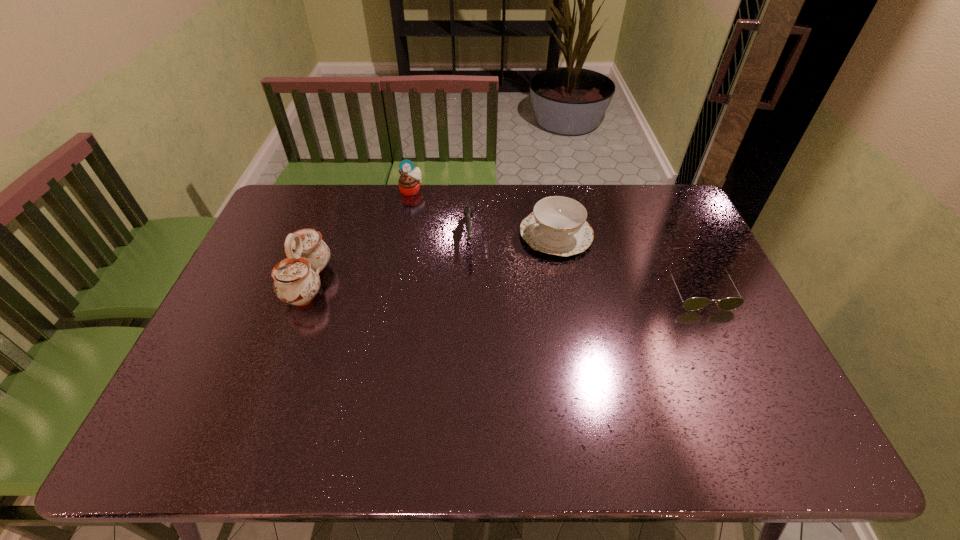
This screenshot has height=540, width=960. What are the coordinates of `vacant space at the near left corner of the desktop` in the screenshot? It's located at (197, 388).

This screenshot has width=960, height=540. Find the location of `free location at the far right corner of the desktop`. free location at the far right corner of the desktop is located at coordinates (680, 211).

The image size is (960, 540). Find the location of `unoccupied area between the third object from right to left and the right chinaware`. unoccupied area between the third object from right to left and the right chinaware is located at coordinates (513, 235).

You are a GUI agent. You are given a task and a screenshot of the screen. Output one action in this format:
    pyautogui.click(x=<x>, y=<y>)
    Task: Click on the free space between the taller chinaware and the gun
    Image resolution: width=960 pixels, height=540 pixels.
    Given the screenshot: What is the action you would take?
    pyautogui.click(x=389, y=259)

Where is `free area in between the gun and the rightmost object`? free area in between the gun and the rightmost object is located at coordinates (584, 262).

You are a GUI agent. You are given a task and a screenshot of the screen. Output one action in this format:
    pyautogui.click(x=<x>, y=<y>)
    Task: Click on the vacant space that's between the third object from right to left and the rightmost object
    
    Given the screenshot: What is the action you would take?
    pyautogui.click(x=584, y=262)

You are a GUI agent. You are given a task and a screenshot of the screen. Output one action in this format:
    pyautogui.click(x=<x>, y=<y>)
    Task: Click on the unoccupied area between the gun and the sunglasses
    The width and height of the screenshot is (960, 540).
    Given the screenshot: What is the action you would take?
    point(584,262)

The image size is (960, 540). I want to click on unoccupied area between the tallest object and the third object from left to right, so click(389, 259).

I want to click on free space between the sunglasses and the third object from left to right, so click(584, 262).

Where is `vacant space in between the rightmost object and the shorter chinaware`? Image resolution: width=960 pixels, height=540 pixels. vacant space in between the rightmost object and the shorter chinaware is located at coordinates (628, 262).